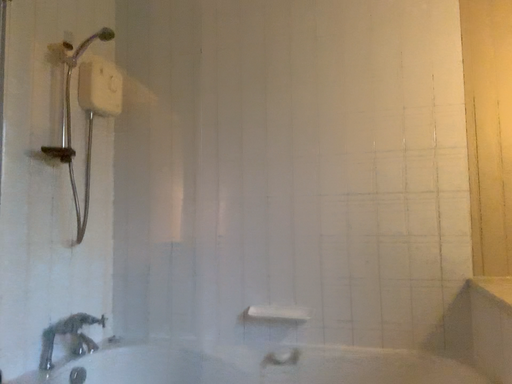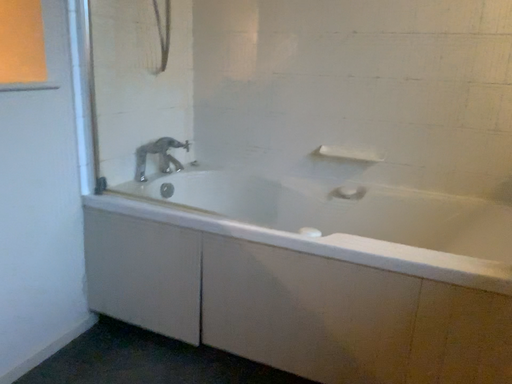
Question: Which way did the camera rotate in the video?

Choices:
 (A) rotated upward
 (B) rotated downward

Answer: (B)